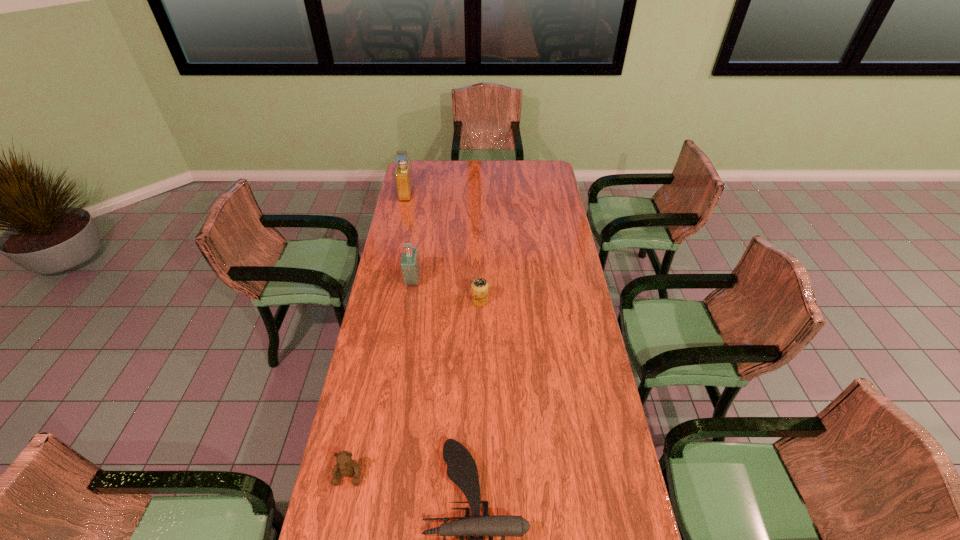
Choose which object is the second nearest neighbor to the third nearest object. Please provide its 2D coordinates. Your answer should be formatted as a tuple, i.e. [(x, y)], where the tuple contains the x and y coordinates of a point satisfying the conditions above.

[(462, 470)]

Choose which object is the fourth nearest neighbor to the teddy bear. Please provide its 2D coordinates. Your answer should be formatted as a tuple, i.e. [(x, y)], where the tuple contains the x and y coordinates of a point satisfying the conditions above.

[(403, 175)]

Where is `vacant area in the image that satisfies the following two spatial constraints: 1. on the back side of the beer can; 2. on the front-facing side of the farthest object`? vacant area in the image that satisfies the following two spatial constraints: 1. on the back side of the beer can; 2. on the front-facing side of the farthest object is located at coordinates (480, 193).

Locate an element on the screen. vacant area that satisfies the following two spatial constraints: 1. on the front-facing side of the farthest object; 2. on the right side of the third farthest object is located at coordinates (383, 301).

This screenshot has height=540, width=960. I want to click on free region that satisfies the following two spatial constraints: 1. on the front label of the right perfume; 2. on the left side of the third farthest object, so click(x=410, y=301).

The height and width of the screenshot is (540, 960). I want to click on vacant region that satisfies the following two spatial constraints: 1. on the front-facing side of the beer can; 2. on the right side of the tallest object, so click(x=383, y=301).